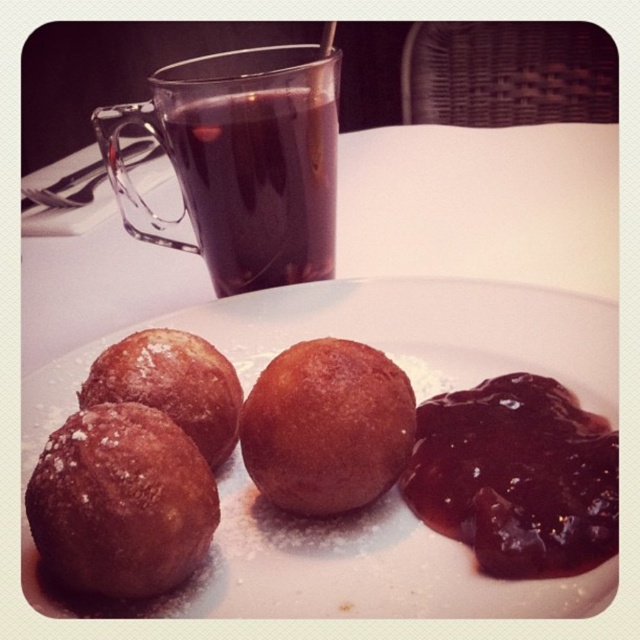
You are sitting at the table and want to reach for the item located at point (211, 108) and the item at point (180, 566). Which item is closer to you?

Point (180, 566) is closer to you because point (211, 108) is behind it.

You are at a table with a plate of food and a beverage. You want to reach for the shiny dark jam at lower right without knocking over the dark brown liquid at upper center. Which item should you move first?

You should move the shiny dark jam at lower right first because it is closer to you than the dark brown liquid at upper center, so you can reach it without disturbing the liquid.